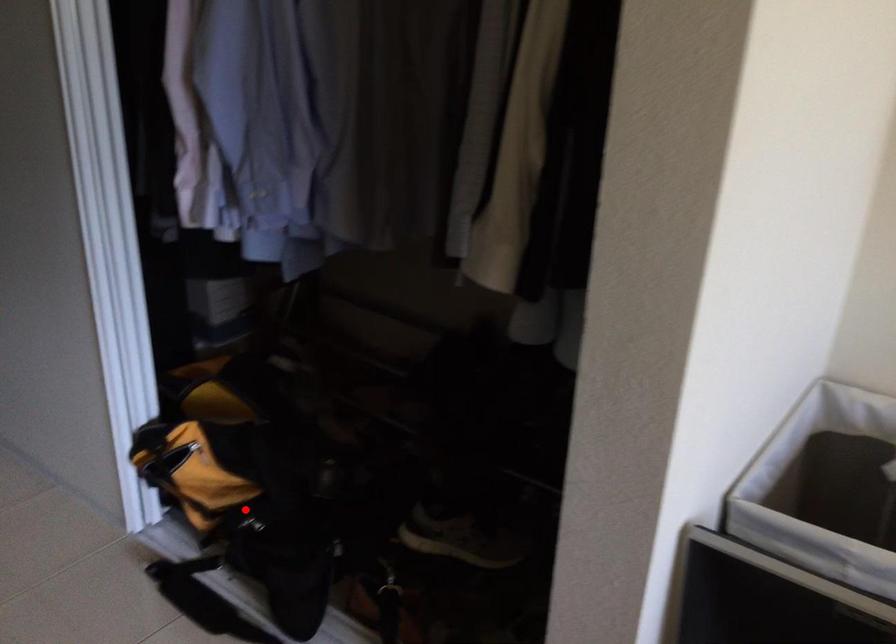
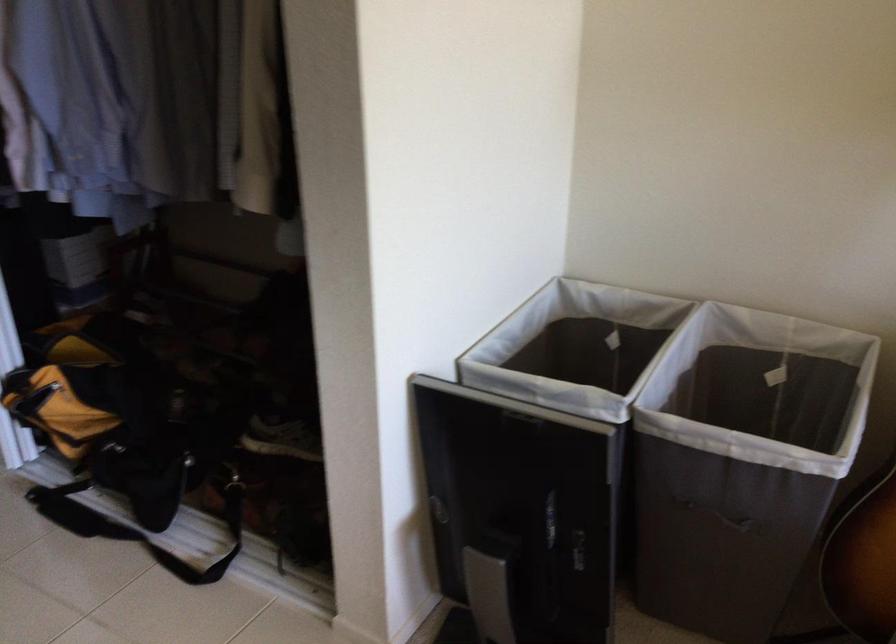
Locate, in the second image, the point that corresponds to the highlighted location in the first image.

(110, 433)